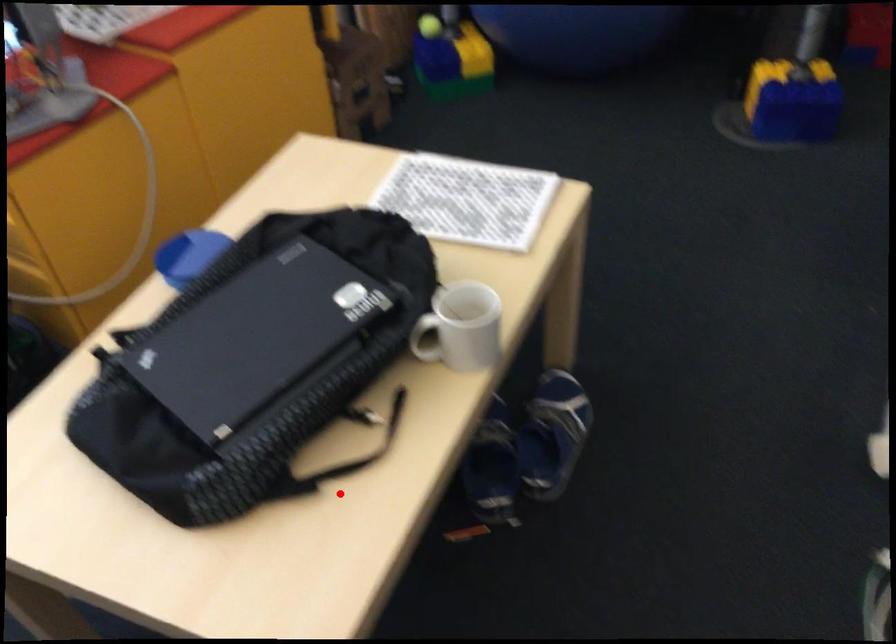
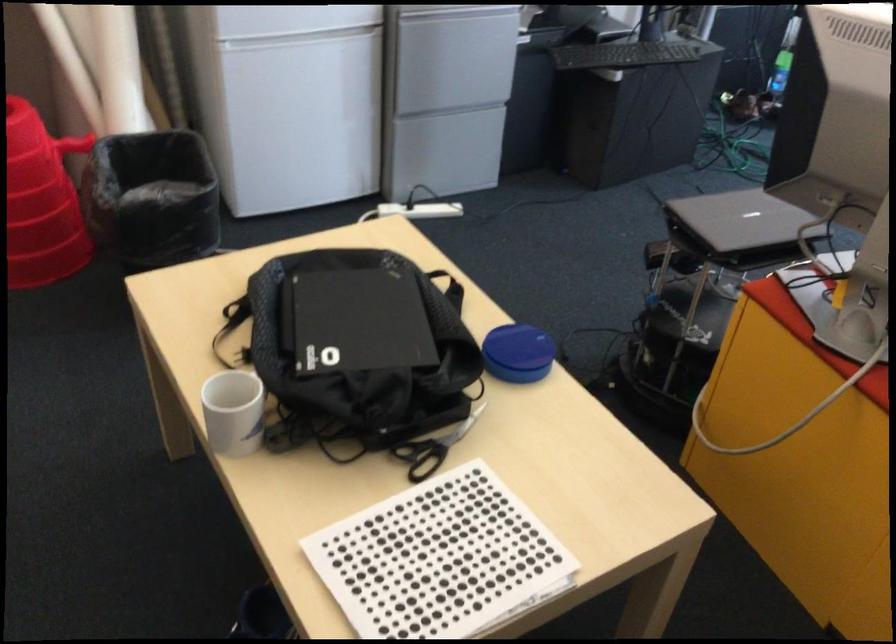
Question: I am providing you with two images of the same scene from different viewpoints. Given a red point in image1, look at the same physical point in image2. Is it:

Choices:
 (A) Closer to the viewpoint
 (B) Farther from the viewpoint

Answer: (B)